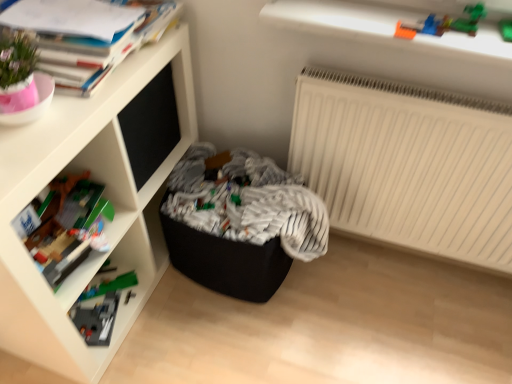
Describe the element at coordinates (104, 196) in the screenshot. The image size is (512, 384). I see `white matte shelf at upper left` at that location.

Where is `black fabric laundry at center`? black fabric laundry at center is located at coordinates (249, 203).

Where is `white matte shelf at upper left`? The height and width of the screenshot is (384, 512). white matte shelf at upper left is located at coordinates (104, 196).

How much distance is there between black fabric laundry at center and matte paper book at upper left?

A distance of 21.38 inches exists between black fabric laundry at center and matte paper book at upper left.

Which object is positioned more to the left, black fabric laundry at center or matte paper book at upper left?

matte paper book at upper left.

How different are the orientations of black fabric laundry at center and matte paper book at upper left in degrees?

black fabric laundry at center and matte paper book at upper left are facing 3.79 degrees away from each other.

Is black fabric laundry at center further to camera compared to matte paper book at upper left?

That is True.

Is point (149, 27) behind point (297, 183)?

No.

How different are the orientations of matte paper book at upper left and black fabric laundry at center in degrees?

3.79 degrees.

From the image's perspective, between matte paper book at upper left and black fabric laundry at center, which one is located above?

From the image's view, matte paper book at upper left is above.

Is there a large distance between matte paper book at upper left and black fabric laundry at center?

No, matte paper book at upper left is not far away from black fabric laundry at center.

Is white matte radiator at upper right facing towards white matte shelf at upper left?

No, white matte radiator at upper right does not turn towards white matte shelf at upper left.

Which object is further away from the camera taking this photo, white matte radiator at upper right or white matte shelf at upper left?

white matte radiator at upper right is behind.

Is point (458, 163) closer to viewer compared to point (13, 325)?

No, it is behind (13, 325).

From the image's perspective, is matte paper book at upper left located above or below white matte radiator at upper right?

From the image's perspective, matte paper book at upper left appears above white matte radiator at upper right.

Could you tell me if matte paper book at upper left is facing white matte radiator at upper right?

No, matte paper book at upper left is not aimed at white matte radiator at upper right.

Does matte paper book at upper left contain white matte radiator at upper right?

No, white matte radiator at upper right is not inside matte paper book at upper left.

Is point (160, 10) closer to camera compared to point (485, 186)?

Yes.

Considering the relative positions of black fabric laundry at center and white matte shelf at upper left in the image provided, is black fabric laundry at center to the left or to the right of white matte shelf at upper left?

black fabric laundry at center is positioned on white matte shelf at upper left's right side.

How much distance is there between black fabric laundry at center and white matte shelf at upper left?

The distance of black fabric laundry at center from white matte shelf at upper left is 12.63 inches.

Is black fabric laundry at center facing away from white matte shelf at upper left?

Yes, black fabric laundry at center's orientation is away from white matte shelf at upper left.

Is black fabric laundry at center wider than white matte shelf at upper left?

Yes, black fabric laundry at center is wider than white matte shelf at upper left.

Is point (322, 249) in front of point (377, 109)?

That is False.

Is black fabric laundry at center next to white matte radiator at upper right and touching it?

No, black fabric laundry at center is not making contact with white matte radiator at upper right.

The height and width of the screenshot is (384, 512). Find the location of `radiator above the black fabric laundry at center (from a real-world perspective)`. radiator above the black fabric laundry at center (from a real-world perspective) is located at coordinates (407, 164).

Can you tell me how much black fabric laundry at center and white matte radiator at upper right differ in facing direction?

They differ by 87.4 degrees in their facing directions.

Are white matte radiator at upper right and black fabric laundry at center far apart?

white matte radiator at upper right is near black fabric laundry at center, not far away.

From the image's perspective, is white matte radiator at upper right beneath black fabric laundry at center?

No.

Relative to black fabric laundry at center, is white matte radiator at upper right in front or behind?

Clearly, white matte radiator at upper right is in front of black fabric laundry at center.

You are a GUI agent. You are given a task and a screenshot of the screen. Output one action in this format:
    pyautogui.click(x=<x>, y=<y>)
    Task: Click on the laundry below the matte paper book at upper left (from a real-world perspective)
    
    Given the screenshot: What is the action you would take?
    pyautogui.click(x=249, y=203)

Identify the location of laundry that is below the matte paper book at upper left (from the image's perspective). The height and width of the screenshot is (384, 512). (249, 203).

Looking at this image, looking at the image, which one is located further to black fabric laundry at center, white matte radiator at upper right or white matte shelf at upper left?

white matte shelf at upper left is further to black fabric laundry at center.

Based on the photo, from the image, which object appears to be farther from white matte radiator at upper right, black fabric laundry at center or white matte shelf at upper left?

white matte shelf at upper left lies further to white matte radiator at upper right than the other object.

When comparing their distances from matte paper book at upper left, does white matte shelf at upper left or black fabric laundry at center seem closer?

white matte shelf at upper left lies closer to matte paper book at upper left than the other object.

Which object lies further to the anchor point white matte radiator at upper right, white matte shelf at upper left or black fabric laundry at center?

white matte shelf at upper left.

When comparing their distances from white matte shelf at upper left, does black fabric laundry at center or white matte radiator at upper right seem further?

The object further to white matte shelf at upper left is white matte radiator at upper right.

In the scene shown: Considering their positions, is matte paper book at upper left positioned further to black fabric laundry at center than white matte radiator at upper right?

matte paper book at upper left is further to black fabric laundry at center.

Looking at the image, which one is located closer to black fabric laundry at center, white matte shelf at upper left or white matte radiator at upper right?

Based on the image, white matte radiator at upper right appears to be nearer to black fabric laundry at center.

Considering their positions, is matte paper book at upper left positioned further to white matte radiator at upper right than white matte shelf at upper left?

matte paper book at upper left is positioned further to the anchor white matte radiator at upper right.

Identify the location of laundry between white matte shelf at upper left and white matte radiator at upper right. (249, 203).

This screenshot has height=384, width=512. I want to click on book located between white matte shelf at upper left and white matte radiator at upper right in the left-right direction, so click(x=100, y=48).

Locate an element on the screen. book situated between white matte shelf at upper left and black fabric laundry at center from left to right is located at coordinates (100, 48).

The image size is (512, 384). Identify the location of laundry between matte paper book at upper left and white matte radiator at upper right. (249, 203).